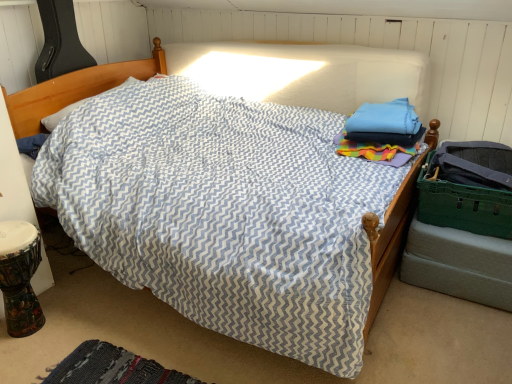
Question: Does woven fabric mat at lower left appear on the left side of green plastic laundry basket at right?

Choices:
 (A) no
 (B) yes

Answer: (B)

Question: Could you tell me if woven fabric mat at lower left is facing green plastic laundry basket at right?

Choices:
 (A) yes
 (B) no

Answer: (B)

Question: Is the depth of woven fabric mat at lower left less than that of green plastic laundry basket at right?

Choices:
 (A) no
 (B) yes

Answer: (B)

Question: Is woven fabric mat at lower left to the right of green plastic laundry basket at right from the viewer's perspective?

Choices:
 (A) yes
 (B) no

Answer: (B)

Question: Are woven fabric mat at lower left and green plastic laundry basket at right making contact?

Choices:
 (A) no
 (B) yes

Answer: (A)

Question: From the image's perspective, is woven fabric mat at lower left beneath green plastic laundry basket at right?

Choices:
 (A) yes
 (B) no

Answer: (A)

Question: Is green plastic laundry basket at right facing away from woven fabric mat at lower left?

Choices:
 (A) yes
 (B) no

Answer: (B)

Question: Is green plastic laundry basket at right aimed at woven fabric mat at lower left?

Choices:
 (A) yes
 (B) no

Answer: (B)

Question: From a real-world perspective, is green plastic laundry basket at right below woven fabric mat at lower left?

Choices:
 (A) no
 (B) yes

Answer: (A)

Question: From the image's perspective, is green plastic laundry basket at right below woven fabric mat at lower left?

Choices:
 (A) yes
 (B) no

Answer: (B)

Question: From the image's perspective, is green plastic laundry basket at right above woven fabric mat at lower left?

Choices:
 (A) no
 (B) yes

Answer: (B)

Question: Considering the relative positions of green plastic laundry basket at right and woven fabric mat at lower left in the image provided, is green plastic laundry basket at right to the left of woven fabric mat at lower left from the viewer's perspective?

Choices:
 (A) no
 (B) yes

Answer: (A)

Question: From the image's perspective, is green plastic laundry basket at right above or below woven fabric mat at lower left?

Choices:
 (A) above
 (B) below

Answer: (A)